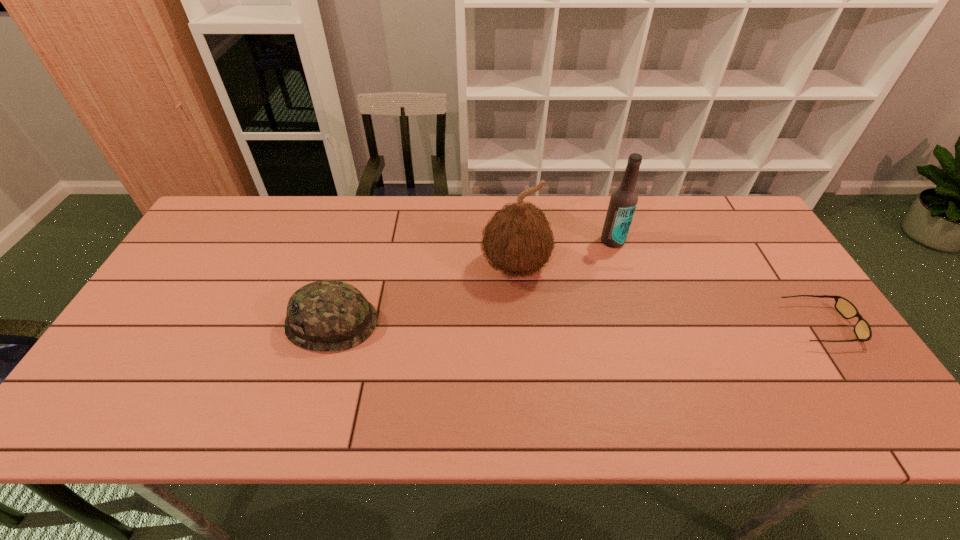
At what (x,y) coordinates should I click in order to perform the action: click on unoccupied position between the third object from right to left and the beer bottle. Please return your answer as a coordinate pair (x, y). The height and width of the screenshot is (540, 960). Looking at the image, I should click on (564, 254).

Identify the location of vacant space that's between the coconut and the leftmost object. The width and height of the screenshot is (960, 540). (424, 294).

The width and height of the screenshot is (960, 540). What are the coordinates of `free spot between the second object from left to right and the second object from right to left` in the screenshot? It's located at (564, 254).

The image size is (960, 540). In order to click on free space between the third tallest object and the coconut in this screenshot , I will do `click(424, 294)`.

Identify the location of vacant space that's between the second object from right to left and the second shortest object. Image resolution: width=960 pixels, height=540 pixels. (472, 281).

You are a GUI agent. You are given a task and a screenshot of the screen. Output one action in this format:
    pyautogui.click(x=<x>, y=<y>)
    Task: Click on the vacant space that is in between the beer bottle and the third object from right to left
    Image resolution: width=960 pixels, height=540 pixels.
    Given the screenshot: What is the action you would take?
    pyautogui.click(x=564, y=254)

Where is `empty space that is in between the coconut and the sunglasses`? The width and height of the screenshot is (960, 540). empty space that is in between the coconut and the sunglasses is located at coordinates (669, 296).

Where is `empty space that is in between the rightmost object and the beer bottle`? This screenshot has height=540, width=960. empty space that is in between the rightmost object and the beer bottle is located at coordinates (717, 283).

Identify the location of vacant area that lies between the coconut and the second object from right to left. (564, 254).

You are a GUI agent. You are given a task and a screenshot of the screen. Output one action in this format:
    pyautogui.click(x=<x>, y=<y>)
    Task: Click on the empty space between the coconut and the rightmost object
    The width and height of the screenshot is (960, 540).
    Given the screenshot: What is the action you would take?
    pyautogui.click(x=669, y=296)